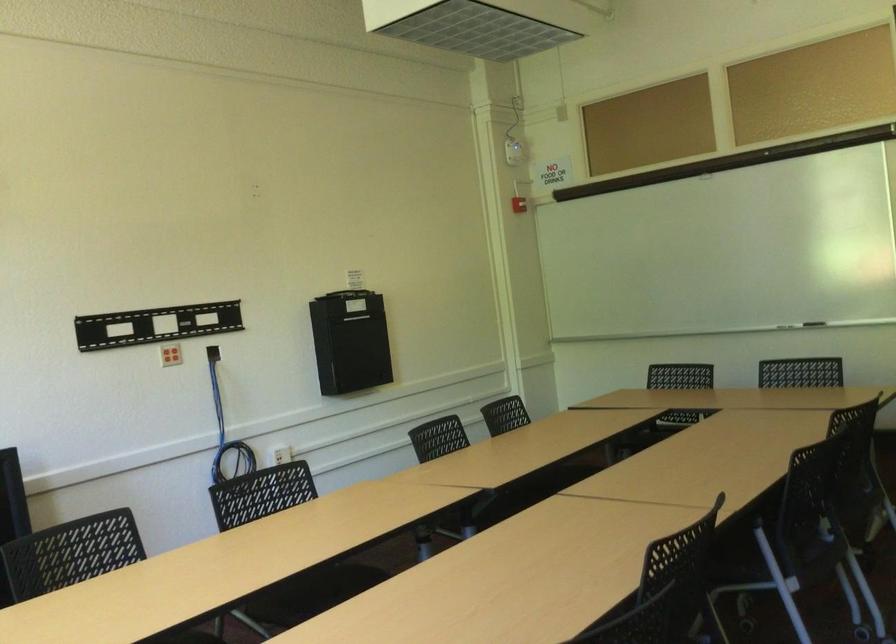
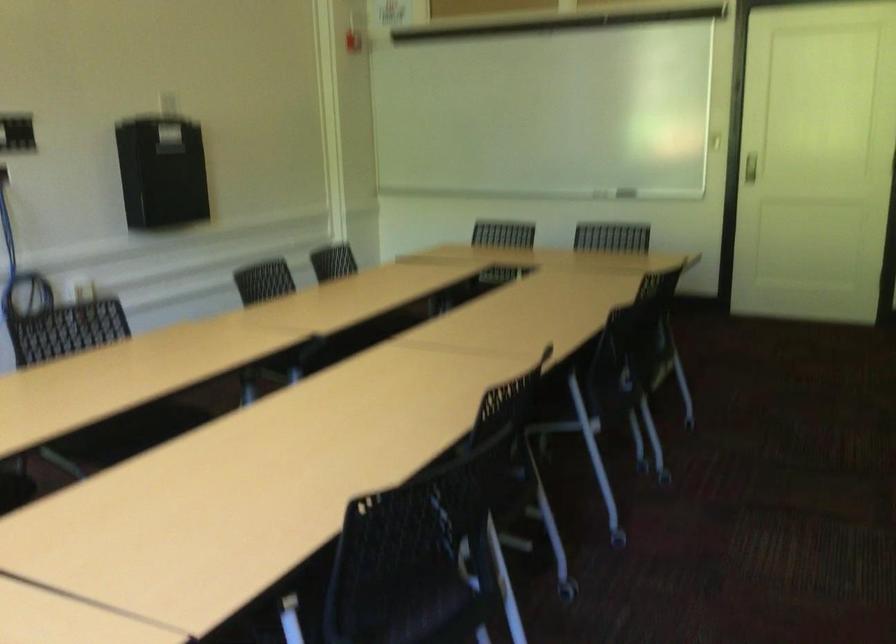
Question: How did the camera likely rotate?

Choices:
 (A) Left
 (B) Right
 (C) Up
 (D) Down

Answer: (B)